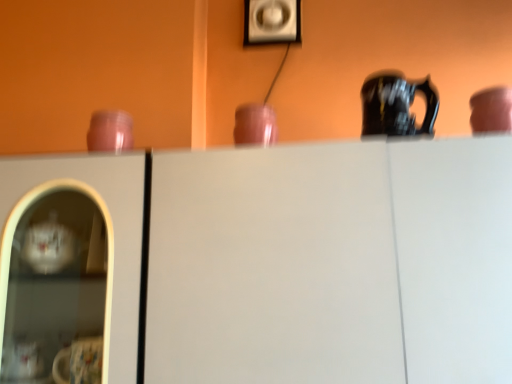
Question: Is matte pink cup at upper right, placed as the 3th tableware when sorted from left to right, at the right side of white matte cabinet at center?

Choices:
 (A) no
 (B) yes

Answer: (B)

Question: Can you confirm if matte pink cup at upper right, placed as the 3th tableware when sorted from left to right, is smaller than white matte cabinet at center?

Choices:
 (A) no
 (B) yes

Answer: (B)

Question: Considering the relative sizes of matte pink cup at upper right, placed as the 3th tableware when sorted from left to right, and white matte cabinet at center in the image provided, is matte pink cup at upper right, placed as the 3th tableware when sorted from left to right, bigger than white matte cabinet at center?

Choices:
 (A) no
 (B) yes

Answer: (A)

Question: Considering the relative positions of matte pink cup at upper right, which appears as the 1th tableware when viewed from the right, and white matte cabinet at center in the image provided, is matte pink cup at upper right, which appears as the 1th tableware when viewed from the right, to the left of white matte cabinet at center from the viewer's perspective?

Choices:
 (A) yes
 (B) no

Answer: (B)

Question: Considering the relative sizes of matte pink cup at upper right, placed as the 3th tableware when sorted from left to right, and white matte cabinet at center in the image provided, is matte pink cup at upper right, placed as the 3th tableware when sorted from left to right, wider than white matte cabinet at center?

Choices:
 (A) yes
 (B) no

Answer: (B)

Question: Considering the positions of matte plastic picture frame at upper center and matte pink cup at upper right, which appears as the 1th tableware when viewed from the right, in the image, is matte plastic picture frame at upper center taller or shorter than matte pink cup at upper right, which appears as the 1th tableware when viewed from the right,?

Choices:
 (A) short
 (B) tall

Answer: (B)

Question: From the image's perspective, is matte plastic picture frame at upper center located above or below matte pink cup at upper right, which appears as the 1th tableware when viewed from the right?

Choices:
 (A) below
 (B) above

Answer: (B)

Question: In terms of width, does matte plastic picture frame at upper center look wider or thinner when compared to matte pink cup at upper right, placed as the 3th tableware when sorted from left to right?

Choices:
 (A) thin
 (B) wide

Answer: (A)

Question: Is point (280, 13) positioned closer to the camera than point (498, 97)?

Choices:
 (A) farther
 (B) closer

Answer: (A)

Question: From the image's perspective, is matte plastic picture frame at upper center positioned above or below matte pink cup at center, positioned as the second tableware in left-to-right order?

Choices:
 (A) below
 (B) above

Answer: (B)

Question: Considering the positions of matte plastic picture frame at upper center and matte pink cup at center, positioned as the second tableware in left-to-right order, in the image, is matte plastic picture frame at upper center wider or thinner than matte pink cup at center, positioned as the second tableware in left-to-right order,?

Choices:
 (A) wide
 (B) thin

Answer: (B)

Question: Based on their sizes in the image, would you say matte plastic picture frame at upper center is bigger or smaller than matte pink cup at center, positioned as the second tableware in left-to-right order?

Choices:
 (A) big
 (B) small

Answer: (A)

Question: From a real-world perspective, is matte plastic picture frame at upper center positioned above or below matte pink cup at center, positioned as the second tableware in left-to-right order?

Choices:
 (A) below
 (B) above

Answer: (B)

Question: From the image's perspective, is matte pink cup at center, acting as the second tableware starting from the right, located above or below white matte cabinet at center?

Choices:
 (A) above
 (B) below

Answer: (A)

Question: In terms of size, does matte pink cup at center, positioned as the second tableware in left-to-right order, appear bigger or smaller than white matte cabinet at center?

Choices:
 (A) big
 (B) small

Answer: (B)